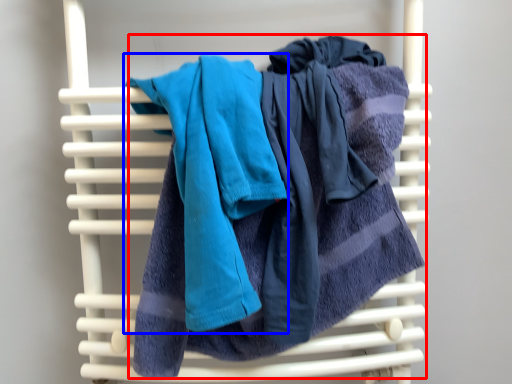
Question: Which point is closer to the camera, towel (highlighted by a red box) or towel (highlighted by a blue box)?

Choices:
 (A) towel
 (B) towel

Answer: (B)